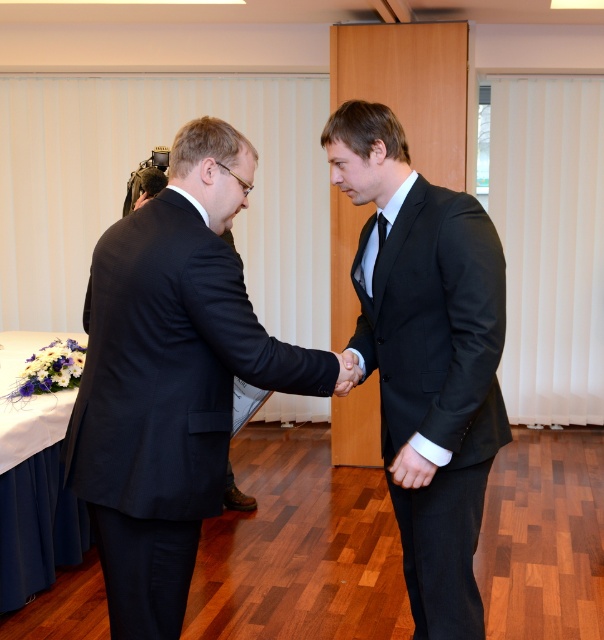
Is black textured suit at center positioned at the back of black silk tie at center?

No.

Can you confirm if black textured suit at center is positioned above black silk tie at center?

No.

What are the coordinates of `black textured suit at center` in the screenshot? It's located at tap(170, 378).

Find the location of a particular element. This screenshot has height=640, width=604. black textured suit at center is located at coordinates (170, 378).

I want to click on black textured suit at center, so click(170, 378).

Can you confirm if black textured suit at center is positioned above black matte hand at center?

Incorrect, black textured suit at center is not positioned above black matte hand at center.

Image resolution: width=604 pixels, height=640 pixels. What are the coordinates of `black textured suit at center` in the screenshot? It's located at (170, 378).

At what (x,y) coordinates should I click in order to perform the action: click on black textured suit at center. Please return your answer as a coordinate pair (x, y). The width and height of the screenshot is (604, 640). Looking at the image, I should click on (170, 378).

Can you confirm if black satin suit at center is smaller than black silk tie at center?

No.

Is black satin suit at center further to camera compared to black silk tie at center?

No, black satin suit at center is in front of black silk tie at center.

The width and height of the screenshot is (604, 640). In order to click on black satin suit at center in this screenshot , I will do `click(426, 356)`.